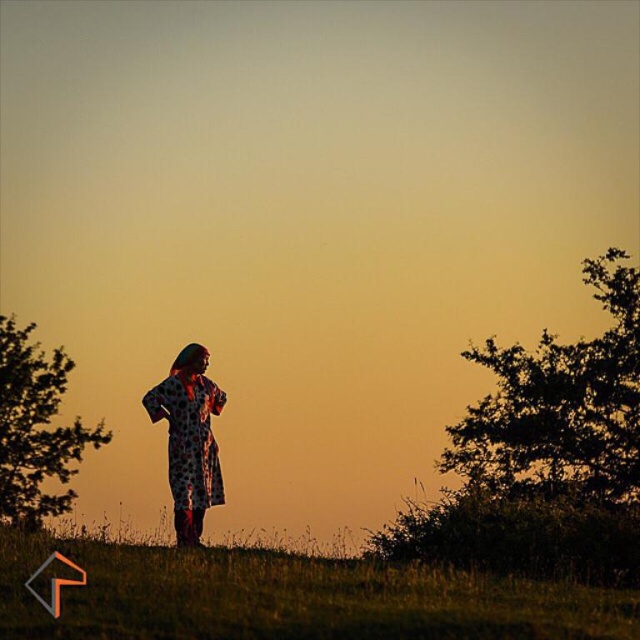
Question: Which point is closer to the camera?

Choices:
 (A) green grassy at lower center
 (B) green leafy tree at left
 (C) printed fabric dress at center
 (D) dark green leafy tree at right

Answer: (A)

Question: Is green grassy at lower center to the left of green leafy tree at left from the viewer's perspective?

Choices:
 (A) no
 (B) yes

Answer: (A)

Question: Based on their relative distances, which object is farther from the green grassy at lower center?

Choices:
 (A) printed fabric dress at center
 (B) dark green leafy tree at right
 (C) green leafy tree at left

Answer: (C)

Question: Which point is farther to the camera?

Choices:
 (A) green leafy tree at left
 (B) dark green leafy tree at right
 (C) printed fabric dress at center

Answer: (A)

Question: Does green leafy tree at left have a larger size compared to printed fabric dress at center?

Choices:
 (A) no
 (B) yes

Answer: (B)

Question: Is green grassy at lower center above dark green leafy tree at right?

Choices:
 (A) no
 (B) yes

Answer: (B)